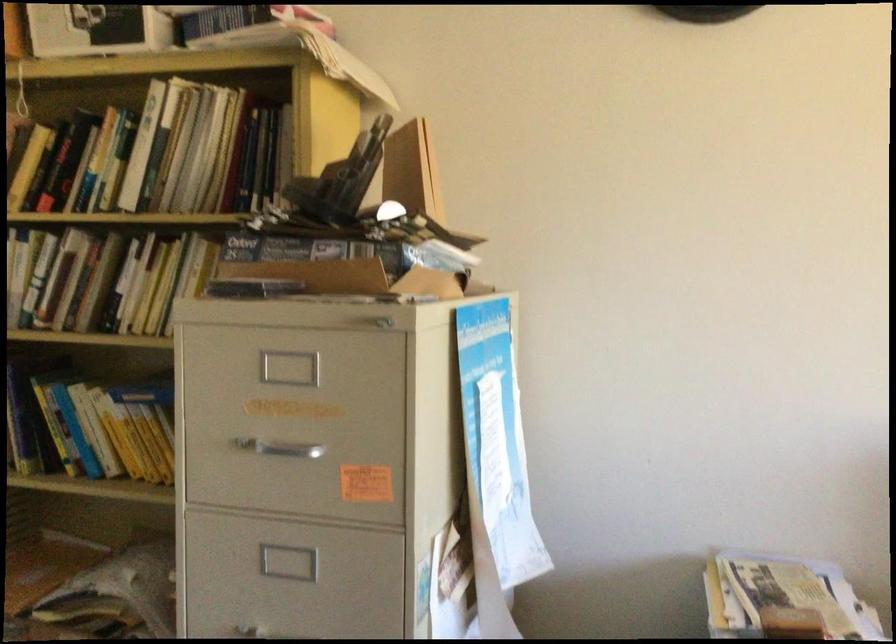
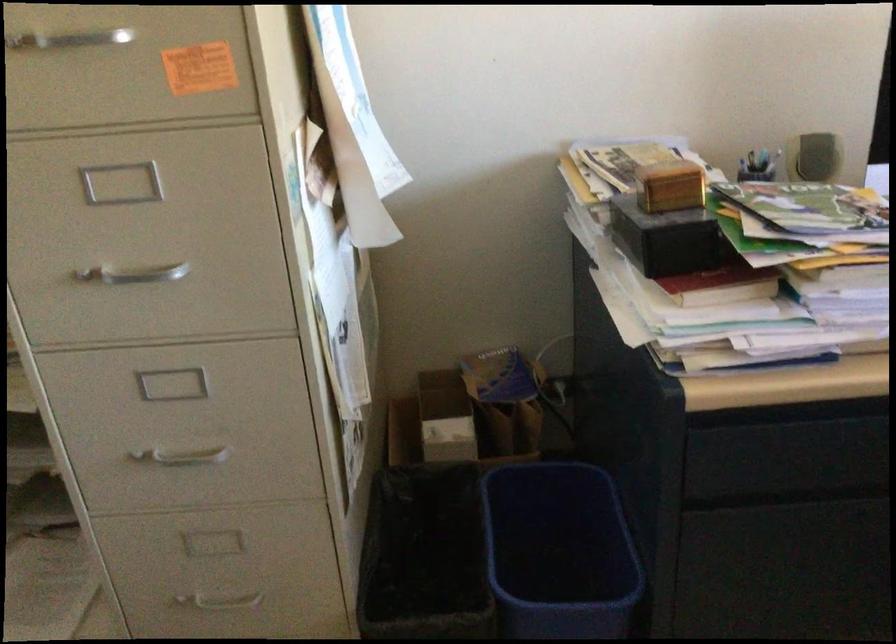
The images are taken continuously from a first-person perspective. In which direction are you moving?

The cameraman moved toward left, forward.